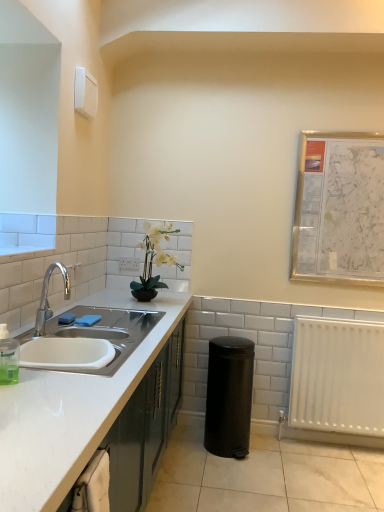
Locate an element on the screen. The image size is (384, 512). vacant space to the right of translucent plastic soap dispenser at sink left is located at coordinates (63, 382).